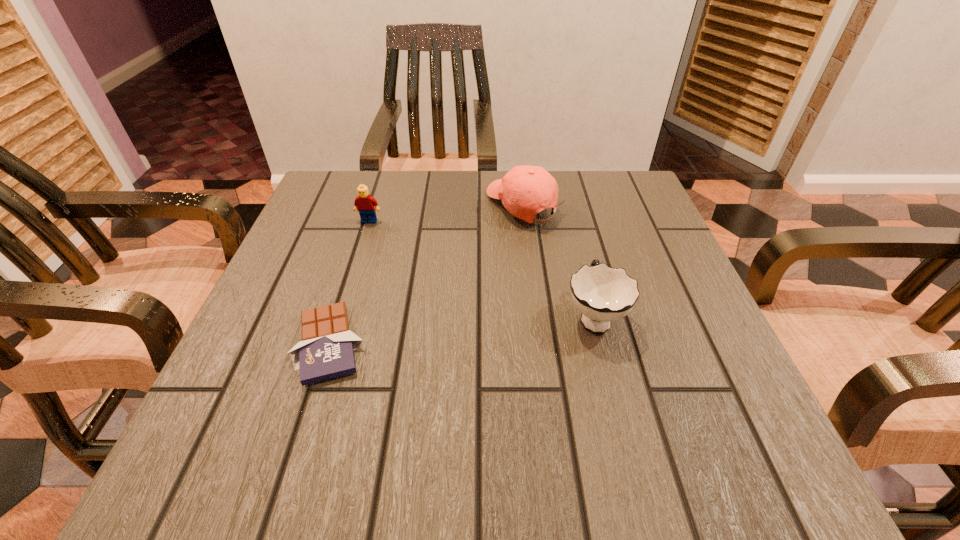
You are a GUI agent. You are given a task and a screenshot of the screen. Output one action in this format:
    pyautogui.click(x=<x>, y=<y>)
    Task: Click on the baseball cap
    Image resolution: width=960 pixels, height=540 pixels.
    Given the screenshot: What is the action you would take?
    pyautogui.click(x=513, y=189)

In order to click on cup in this screenshot , I will do 602,294.

Find the location of a particular element. The width and height of the screenshot is (960, 540). Lego is located at coordinates [x=364, y=203].

Identify the location of the shortest object. point(326,351).

Find the location of a particular element. vacant region located on the front of the baseball cap is located at coordinates (540, 336).

Where is `free point located 0.350m on the side of the cup with the handle`? free point located 0.350m on the side of the cup with the handle is located at coordinates point(562,188).

The height and width of the screenshot is (540, 960). I want to click on vacant space located 0.090m on the side of the cup with the handle, so click(579, 257).

This screenshot has height=540, width=960. I want to click on vacant space located 0.310m on the side of the cup with the handle, so click(x=564, y=197).

You are a GUI agent. You are given a task and a screenshot of the screen. Output one action in this format:
    pyautogui.click(x=<x>, y=<y>)
    Task: Click on the free region located 0.130m on the front-facing side of the Lego
    
    Given the screenshot: What is the action you would take?
    pyautogui.click(x=356, y=262)

This screenshot has height=540, width=960. In order to click on free space located 0.250m on the right of the chocolate bar in this screenshot , I will do `click(517, 344)`.